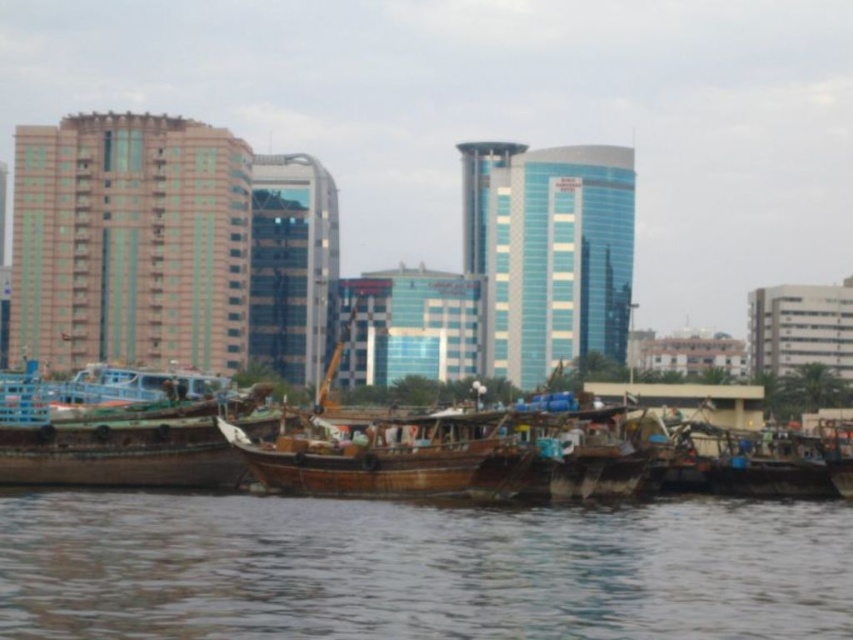
Question: Which is farther from the wooden boat at center?

Choices:
 (A) brown water at lower center
 (B) wooden boat at left

Answer: (A)

Question: Is brown water at lower center positioned in front of wooden boat at center?

Choices:
 (A) yes
 (B) no

Answer: (A)

Question: Does brown water at lower center have a lesser width compared to wooden boat at center?

Choices:
 (A) yes
 (B) no

Answer: (B)

Question: Is brown water at lower center bigger than wooden boat at center?

Choices:
 (A) no
 (B) yes

Answer: (B)

Question: Which point is closer to the camera?

Choices:
 (A) wooden boat at center
 (B) brown water at lower center

Answer: (B)

Question: Which object is positioned closest to the brown water at lower center?

Choices:
 (A) wooden boat at center
 (B) wooden boat at left

Answer: (A)